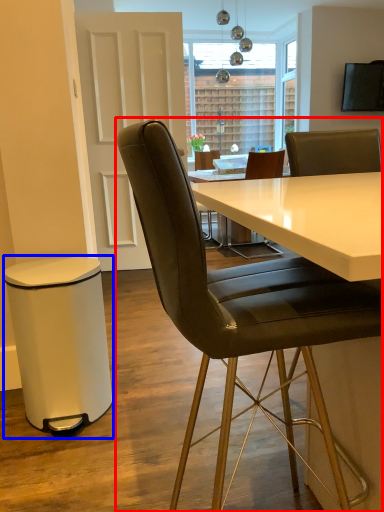
Question: Which of the following is the closest to the observer, chair (highlighted by a red box) or bar stool (highlighted by a blue box)?

Choices:
 (A) chair
 (B) bar stool

Answer: (A)